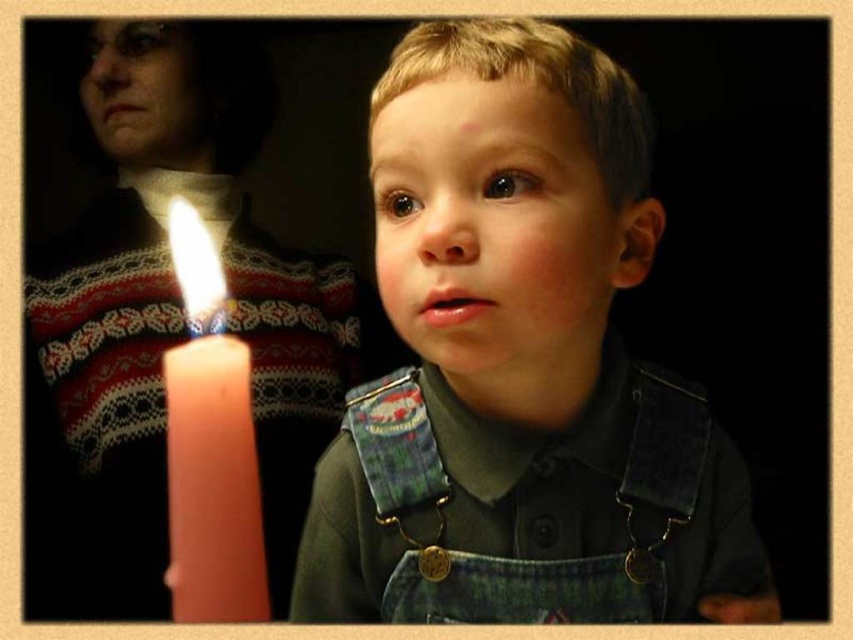
Looking at this image, who is more forward, (x=402, y=104) or (x=242, y=433)?

Point (x=242, y=433) is in front.

Where is `denim overalls at center`? The height and width of the screenshot is (640, 853). denim overalls at center is located at coordinates (520, 364).

Locate an element on the screen. The image size is (853, 640). denim overalls at center is located at coordinates (520, 364).